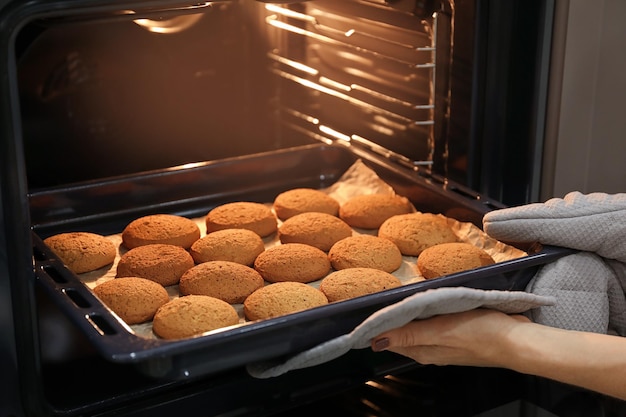
What are the coordinates of `wrungs in oven` in the screenshot? It's located at (576, 287), (580, 219), (474, 294), (418, 50), (414, 106), (416, 155), (416, 0).